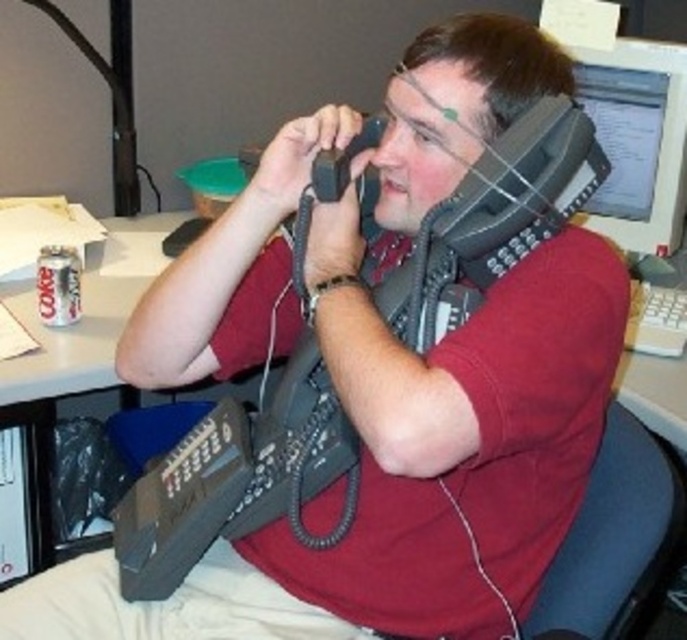
Measure the distance between matte plastic monitor at upper right and camera.

matte plastic monitor at upper right is 1.65 meters from camera.

Who is taller, matte plastic monitor at upper right or black rubber earphone at upper center?

With more height is matte plastic monitor at upper right.

Where is `matte plastic monitor at upper right`? The height and width of the screenshot is (640, 687). matte plastic monitor at upper right is located at coordinates (638, 140).

The image size is (687, 640). Identify the location of matte plastic monitor at upper right. (638, 140).